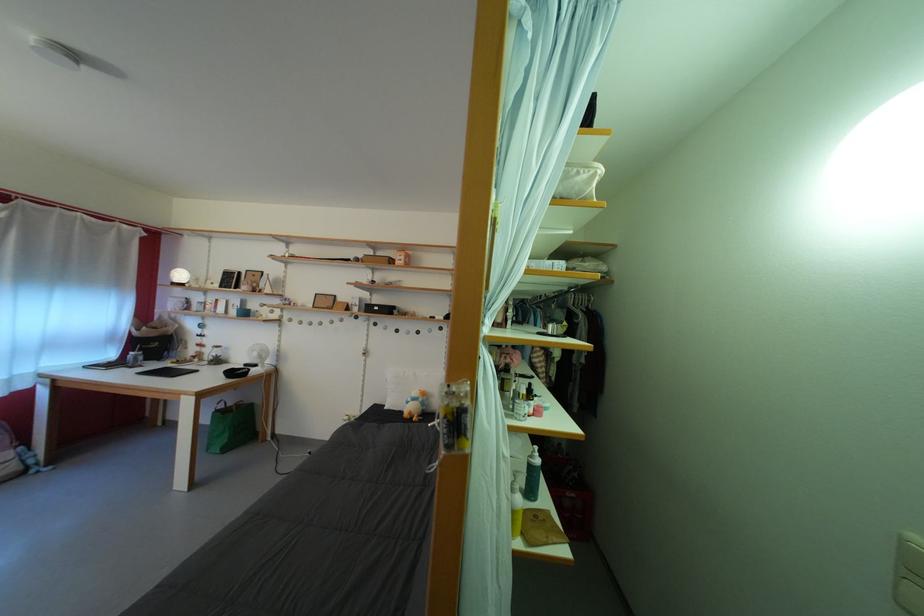
You are a GUI agent. You are given a task and a screenshot of the screen. Output one action in this format:
    pyautogui.click(x=<x>, y=<y>)
    Task: Click on the stuffed penguin toy
    The height and width of the screenshot is (616, 924).
    Given the screenshot: What is the action you would take?
    pyautogui.click(x=415, y=405)